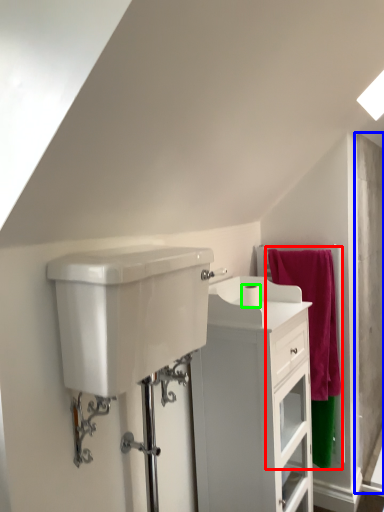
Question: Which object is the farthest from bath towel (highlighted by a red box)? Choose among these: screen door (highlighted by a blue box) or toilet paper (highlighted by a green box).

Choices:
 (A) screen door
 (B) toilet paper

Answer: (B)